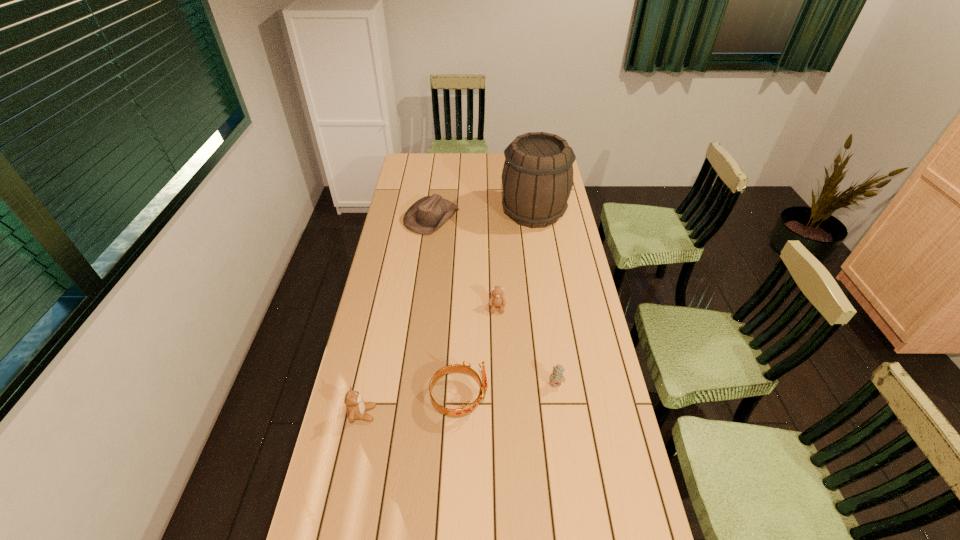
Find the location of `object that is the second closest one to the tallest teddy bear`. object that is the second closest one to the tallest teddy bear is located at coordinates (497, 299).

Choose which teddy bear is the third nearest neighbor to the fedora. Please provide its 2D coordinates. Your answer should be formatted as a tuple, i.e. [(x, y)], where the tuple contains the x and y coordinates of a point satisfying the conditions above.

[(356, 408)]

Identify which teddy bear is the second nearest to the nearest teddy bear. Please provide its 2D coordinates. Your answer should be formatted as a tuple, i.e. [(x, y)], where the tuple contains the x and y coordinates of a point satisfying the conditions above.

[(556, 377)]

The height and width of the screenshot is (540, 960). In order to click on vacant area that satisfies the following two spatial constraints: 1. on the front-facing side of the second farthest teddy bear; 2. on the front-facing side of the fifth shortest object in this screenshot , I will do `click(558, 398)`.

You are a GUI agent. You are given a task and a screenshot of the screen. Output one action in this format:
    pyautogui.click(x=<x>, y=<y>)
    Task: Click on the vacant space that satisfies the following two spatial constraints: 1. on the front-facing side of the second nearest teddy bear; 2. on the front-facing side of the second tallest object
    Image resolution: width=960 pixels, height=540 pixels.
    Given the screenshot: What is the action you would take?
    pyautogui.click(x=558, y=398)

Identify the location of free space that satisfies the following two spatial constraints: 1. on the front-facing side of the third farthest object; 2. on the front-facing side of the nearest teddy bear. This screenshot has height=540, width=960. [x=501, y=414].

This screenshot has height=540, width=960. Find the location of `vacant space that satisfies the following two spatial constraints: 1. on the front side of the tallest object; 2. on the front-facing side of the leftmost teddy bear`. vacant space that satisfies the following two spatial constraints: 1. on the front side of the tallest object; 2. on the front-facing side of the leftmost teddy bear is located at coordinates (564, 414).

Where is `free space that satisfies the following two spatial constraints: 1. on the front-facing side of the second teddy bear from right to left; 2. on the front-facing side of the nearest teddy bear`? The width and height of the screenshot is (960, 540). free space that satisfies the following two spatial constraints: 1. on the front-facing side of the second teddy bear from right to left; 2. on the front-facing side of the nearest teddy bear is located at coordinates (501, 414).

You are a GUI agent. You are given a task and a screenshot of the screen. Output one action in this format:
    pyautogui.click(x=<x>, y=<y>)
    Task: Click on the vacant area in the image that satisfies the following two spatial constraints: 1. on the back side of the fedora; 2. on the left side of the wine bucket
    The height and width of the screenshot is (540, 960).
    Given the screenshot: What is the action you would take?
    pyautogui.click(x=432, y=213)

Identify the location of vacant space that satisfies the following two spatial constraints: 1. on the front-facing side of the third farthest object; 2. on the front-facing side of the nearest teddy bear. The width and height of the screenshot is (960, 540). (501, 414).